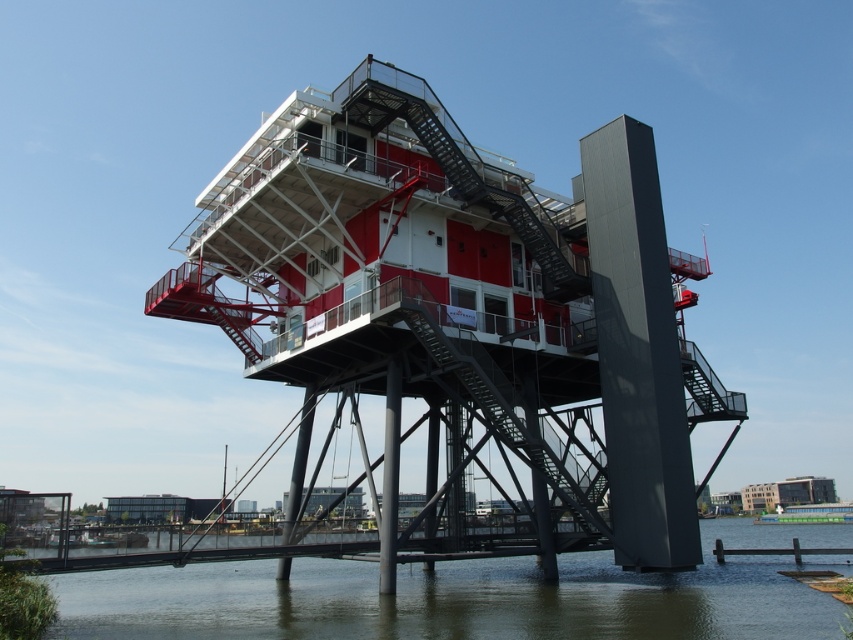
From the picture: Between metallic red observation tower at center and green murky water at lower center, which one has less height?

green murky water at lower center

Where is `metallic red observation tower at center`? metallic red observation tower at center is located at coordinates (463, 301).